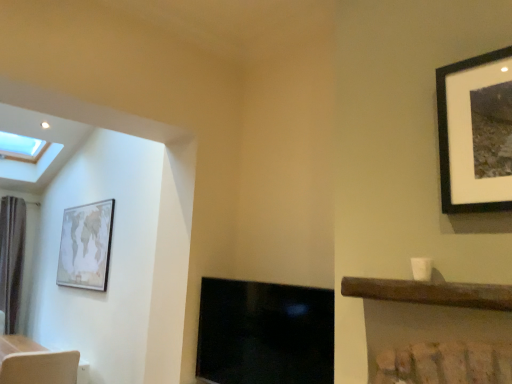
Question: Looking at their shapes, would you say light brown textured swivel chair at lower left is wider or thinner than black glossy fireplace at center?

Choices:
 (A) thin
 (B) wide

Answer: (B)

Question: Relative to black glossy fireplace at center, is light brown textured swivel chair at lower left in front or behind?

Choices:
 (A) front
 (B) behind

Answer: (B)

Question: Which is nearer to the black glossy fireplace at center?

Choices:
 (A) dark brown fabric curtain at left
 (B) light brown textured swivel chair at lower left
 (C) matte wooden map at left

Answer: (B)

Question: Which object is the farthest from the matte wooden map at left?

Choices:
 (A) dark brown fabric curtain at left
 (B) light brown textured swivel chair at lower left
 (C) black glossy fireplace at center

Answer: (C)